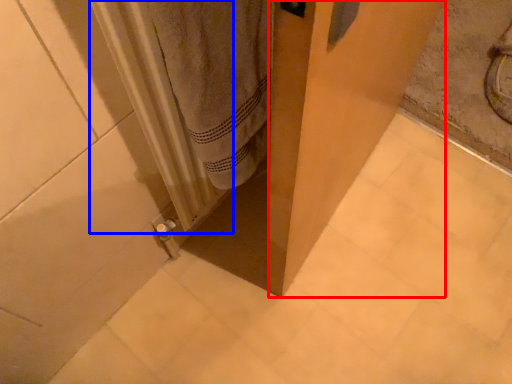
Question: Which object is further to the camera taking this photo, screen door (highlighted by a red box) or radiator (highlighted by a blue box)?

Choices:
 (A) screen door
 (B) radiator

Answer: (B)